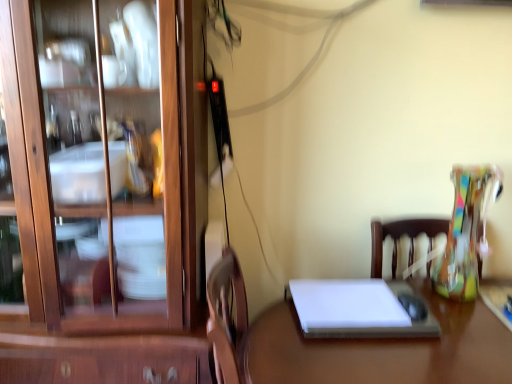
Question: Looking at their shapes, would you say wooden cabinet at left is wider or thinner than white matte notebook at center?

Choices:
 (A) thin
 (B) wide

Answer: (B)

Question: Is wooden cabinet at left situated inside white matte notebook at center or outside?

Choices:
 (A) outside
 (B) inside

Answer: (A)

Question: Which object is the farthest from the white matte notebook at center?

Choices:
 (A) white glossy desk at center
 (B) wooden cabinet at left

Answer: (B)

Question: Which is farther from the white matte notebook at center?

Choices:
 (A) white glossy desk at center
 (B) wooden cabinet at left

Answer: (B)